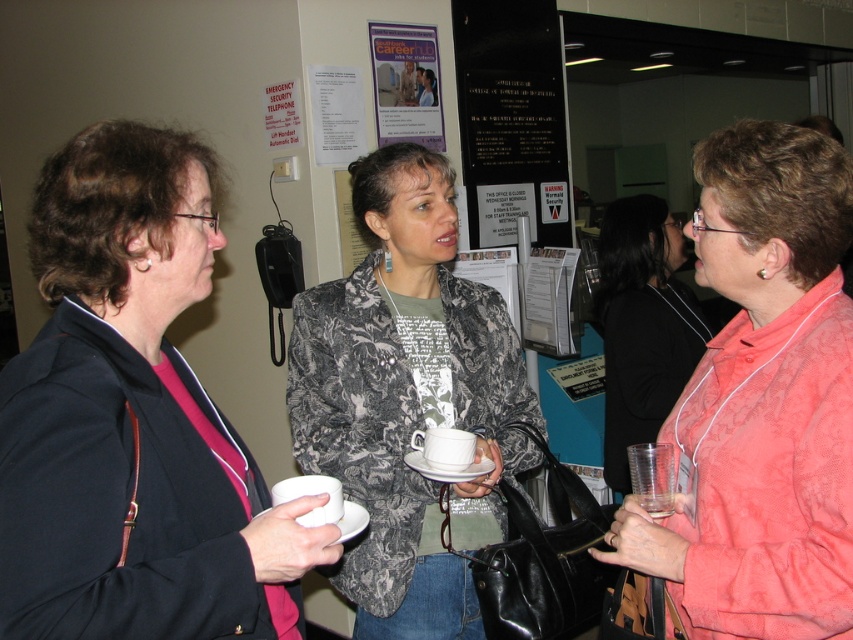
Is point (697, 147) farther from viewer compared to point (670, 470)?

Yes, point (697, 147) is farther from viewer.

What do you see at coordinates (762, 400) in the screenshot? This screenshot has height=640, width=853. I see `pink satin blouse at right` at bounding box center [762, 400].

Locate an element on the screen. pink satin blouse at right is located at coordinates (762, 400).

What do you see at coordinates (132, 419) in the screenshot?
I see `matte black jacket at left` at bounding box center [132, 419].

Is matte black jacket at left further to the viewer compared to pink satin blouse at right?

No, matte black jacket at left is closer to the viewer.

Which is behind, point (49, 499) or point (735, 355)?

Positioned behind is point (735, 355).

At what (x,y) coordinates should I click in order to perform the action: click on matte black jacket at left. Please return your answer as a coordinate pair (x, y). Looking at the image, I should click on (132, 419).

This screenshot has height=640, width=853. What do you see at coordinates (405, 83) in the screenshot? I see `white glossy poster at upper center` at bounding box center [405, 83].

Does white glossy poster at upper center have a smaller size compared to transparent plastic cup at lower right?

No.

Locate an element on the screen. white glossy poster at upper center is located at coordinates (405, 83).